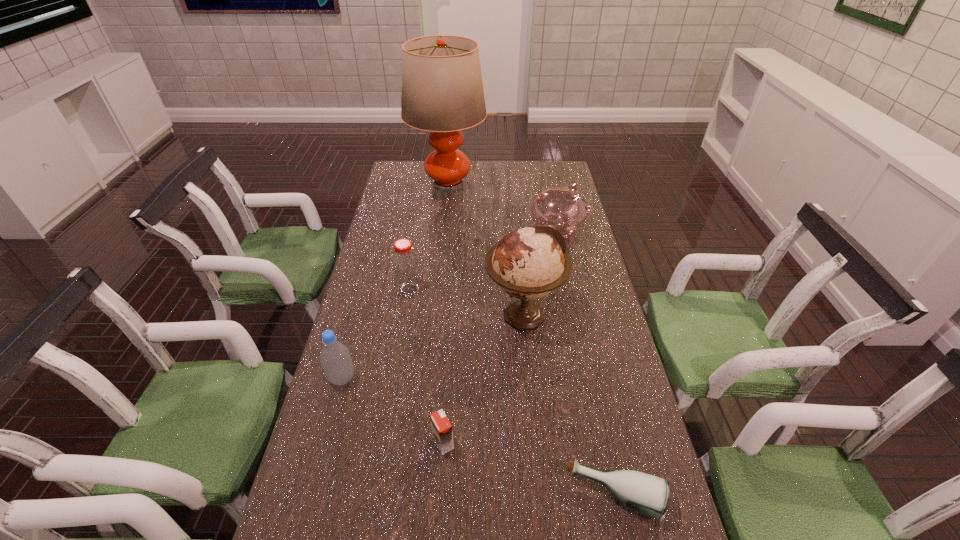
You are a GUI agent. You are given a task and a screenshot of the screen. Output one action in this format:
    pyautogui.click(x=<x>, y=<y>)
    Task: Click on the nearest bottle
    
    Given the screenshot: What is the action you would take?
    pyautogui.click(x=648, y=494)

Locate an element on the screen. This screenshot has width=960, height=540. vacant area located 0.160m on the front of the farthest object is located at coordinates (444, 228).

At what (x,y) coordinates should I click in order to perform the action: click on vacant space situated 0.180m on the front of the globe showing Asia. Please return your answer as a coordinate pair (x, y). This screenshot has width=960, height=540. Looking at the image, I should click on point(426,315).

This screenshot has height=540, width=960. What are the coordinates of `vacant region located on the front of the globe showing Asia` in the screenshot? It's located at (426, 315).

You are a GUI agent. You are given a task and a screenshot of the screen. Output one action in this format:
    pyautogui.click(x=<x>, y=<y>)
    Task: Click on the vacant space positioned on the front of the globe showing Asia
    
    Given the screenshot: What is the action you would take?
    pyautogui.click(x=375, y=315)

Locate an element on the screen. vacant region located 0.130m on the front of the second bottle from right to left is located at coordinates (402, 329).

The image size is (960, 540). Identify the location of vacant position located 0.140m on the front of the leftmost bottle. (325, 439).

You are a GUI agent. You are given a task and a screenshot of the screen. Output one action in this format:
    pyautogui.click(x=<x>, y=<y>)
    Task: Click on the blank area located on the left of the second nearest object
    
    Given the screenshot: What is the action you would take?
    pyautogui.click(x=357, y=443)

Locate an element on the screen. The width and height of the screenshot is (960, 540). free space located on the back of the nearest bottle is located at coordinates (597, 414).

Locate an element on the screen. object that is at the far edge is located at coordinates (442, 90).